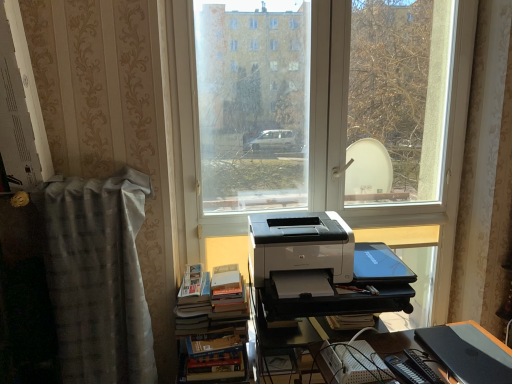
Question: Considering the relative positions of white glossy printer at center and black plastic register at lower right, positioned as the first register in front-to-back order, in the image provided, is white glossy printer at center behind black plastic register at lower right, positioned as the first register in front-to-back order,?

Choices:
 (A) yes
 (B) no

Answer: (A)

Question: Can you confirm if white glossy printer at center is smaller than black plastic register at lower right, which ranks as the first register in right-to-left order?

Choices:
 (A) yes
 (B) no

Answer: (B)

Question: Does white glossy printer at center have a larger size compared to black plastic register at lower right, the second register positioned from the left?

Choices:
 (A) no
 (B) yes

Answer: (B)

Question: Is white glossy printer at center at the right side of black plastic register at lower right, the second register when ordered from back to front?

Choices:
 (A) no
 (B) yes

Answer: (A)

Question: From a real-world perspective, is white glossy printer at center located higher than black plastic register at lower right, which is counted as the 1th register, starting from the bottom?

Choices:
 (A) yes
 (B) no

Answer: (A)

Question: Considering the positions of hardcover book at lower center and gray textured curtain at left in the image, is hardcover book at lower center bigger or smaller than gray textured curtain at left?

Choices:
 (A) big
 (B) small

Answer: (B)

Question: Considering their positions, is hardcover book at lower center located in front of or behind gray textured curtain at left?

Choices:
 (A) behind
 (B) front

Answer: (B)

Question: Is hardcover book at lower center taller or shorter than gray textured curtain at left?

Choices:
 (A) short
 (B) tall

Answer: (A)

Question: Is hardcover book at lower center situated inside gray textured curtain at left or outside?

Choices:
 (A) inside
 (B) outside

Answer: (B)

Question: Considering their positions, is black plastic register at lower right, positioned as the first register in front-to-back order, located in front of or behind white plastic printer at center?

Choices:
 (A) behind
 (B) front

Answer: (B)

Question: Do you think black plastic register at lower right, which ranks as the first register in right-to-left order, is within white plastic printer at center, or outside of it?

Choices:
 (A) inside
 (B) outside

Answer: (B)

Question: From a real-world perspective, is black plastic register at lower right, which ranks as the first register in right-to-left order, physically located above or below white plastic printer at center?

Choices:
 (A) above
 (B) below

Answer: (A)

Question: Visually, is black plastic register at lower right, the second register when ordered from back to front, positioned to the left or to the right of white plastic printer at center?

Choices:
 (A) right
 (B) left

Answer: (A)

Question: From the image's perspective, is black plastic register at lower right, which ranks as the first register in right-to-left order, located above or below hardcover books at center-left?

Choices:
 (A) above
 (B) below

Answer: (B)

Question: From a real-world perspective, is black plastic register at lower right, the second register when ordered from back to front, above or below hardcover books at center-left?

Choices:
 (A) below
 (B) above

Answer: (B)